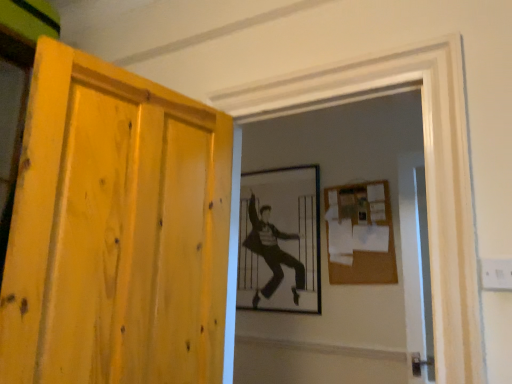
Question: From a real-world perspective, is burlap-like brown bulletin board at upper right physically located above or below black and white photograph of a man at center?

Choices:
 (A) below
 (B) above

Answer: (B)

Question: Is burlap-like brown bulletin board at upper right in front of or behind black and white photograph of a man at center in the image?

Choices:
 (A) behind
 (B) front

Answer: (B)

Question: Estimate the real-world distances between objects in this image. Which object is closer to the black and white photograph of a man at center?

Choices:
 (A) burlap-like brown bulletin board at upper right
 (B) yellow wood door at left
 (C) transparent glass screen door at right

Answer: (A)

Question: Which of these objects is positioned farthest from the yellow wood door at left?

Choices:
 (A) burlap-like brown bulletin board at upper right
 (B) transparent glass screen door at right
 (C) black and white photograph of a man at center

Answer: (C)